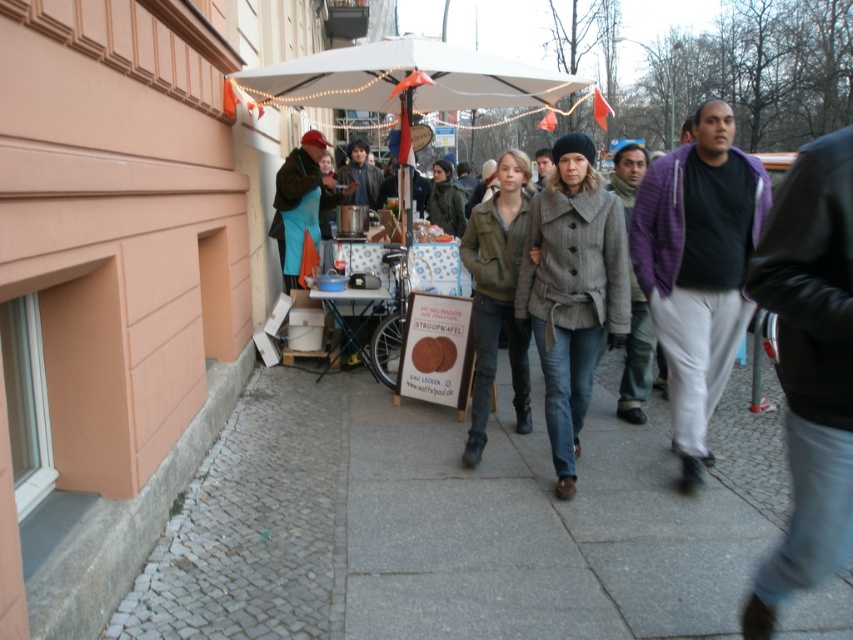
You are a delivery robot with a width of 0.8 meters. You are positioned on the gray cobblestone pavement at lower left and need to reach the gray wool coat at center. Is there enough space for you to move directly to the coat without any obstacles?

The distance between the gray cobblestone pavement at lower left and the gray wool coat at center is 1.13 meters. Since the robot is 0.8 meters wide, there is sufficient space for it to move directly to the coat as the distance is greater than the robot width.

In the scene shown: You are a delivery person who needs to place a small package on the gray cobblestone pavement at lower left or the purple knit sweater at center. Which surface is more suitable for placing the package?

The gray cobblestone pavement at lower left is larger in size than the purple knit sweater at center, so it is more suitable for placing the package.

You are a delivery person standing on the gray cobblestone pavement at lower left and need to reach the gray wool coat at center. Is there any obstacle between you and the coat?

The gray cobblestone pavement at lower left is positioned under the gray wool coat at center, meaning the coat is directly above the pavement. Since the pavement is under the coat, there is no obstacle between them, so you can reach the coat without any hindrance.